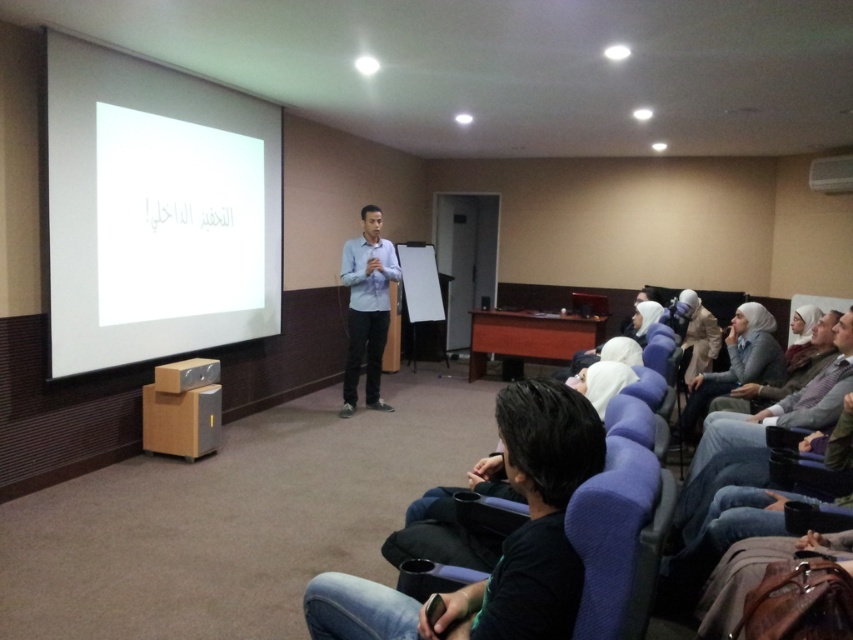
Question: Can you confirm if white matte projection screen at upper left is wider than white plastic projector at upper right?

Choices:
 (A) no
 (B) yes

Answer: (B)

Question: Is black matte shirt at lower center smaller than white fabric hijab at lower right?

Choices:
 (A) yes
 (B) no

Answer: (A)

Question: Which of the following is the closest to the observer?

Choices:
 (A) black matte shirt at lower center
 (B) white plastic projector at upper right
 (C) white matte projection screen at upper left

Answer: (A)

Question: Which point appears farthest from the camera in this image?

Choices:
 (A) (486, 472)
 (B) (74, 141)

Answer: (B)

Question: Which point is farther from the camera taking this photo?

Choices:
 (A) (694, 394)
 (B) (360, 362)
 (C) (541, 397)
 (D) (850, 156)

Answer: (D)

Question: Is white fabric hijab at lower right wider than white plastic projector at upper right?

Choices:
 (A) no
 (B) yes

Answer: (B)